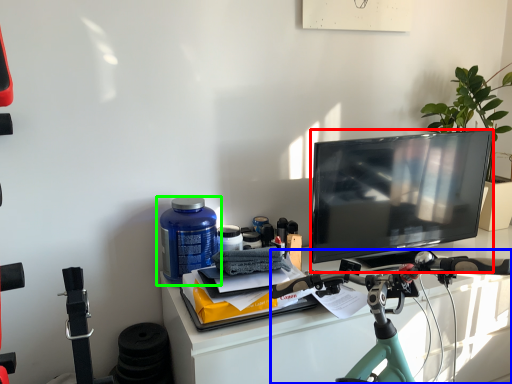
Question: Which object is the closest to the television (highlighted by a red box)? Choose among these: bicycle (highlighted by a blue box) or bottle (highlighted by a green box).

Choices:
 (A) bicycle
 (B) bottle

Answer: (A)